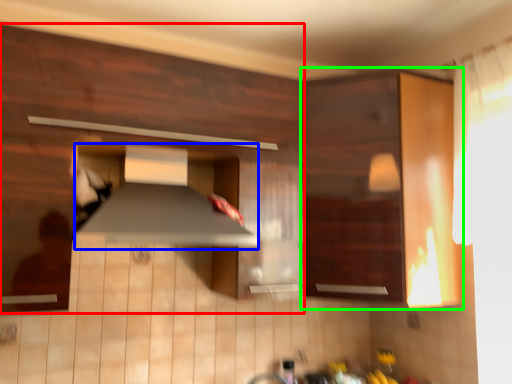
Question: Which object is positioned farthest from cabinetry (highlighted by a red box)? Select from exhaust hood (highlighted by a blue box) and cabinetry (highlighted by a green box).

Choices:
 (A) exhaust hood
 (B) cabinetry

Answer: (B)